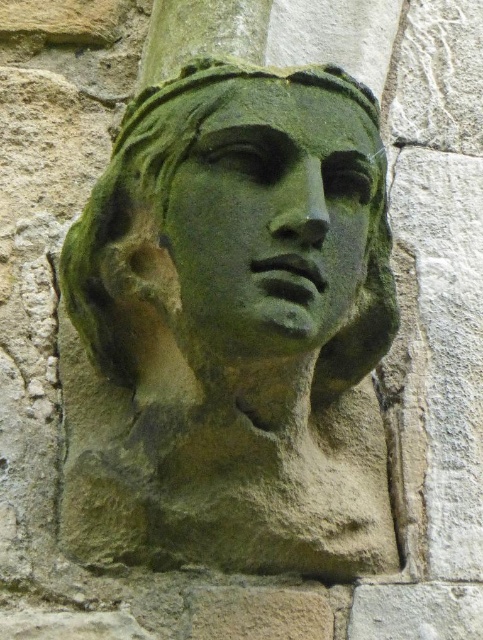
Question: Is green stone bust at center above green stone face at center?

Choices:
 (A) no
 (B) yes

Answer: (A)

Question: Can you confirm if green stone bust at center is wider than green stone face at center?

Choices:
 (A) yes
 (B) no

Answer: (A)

Question: Is the position of green stone bust at center less distant than that of green stone face at center?

Choices:
 (A) yes
 (B) no

Answer: (B)

Question: Which object appears closest to the camera in this image?

Choices:
 (A) green stone face at center
 (B) green stone bust at center

Answer: (A)